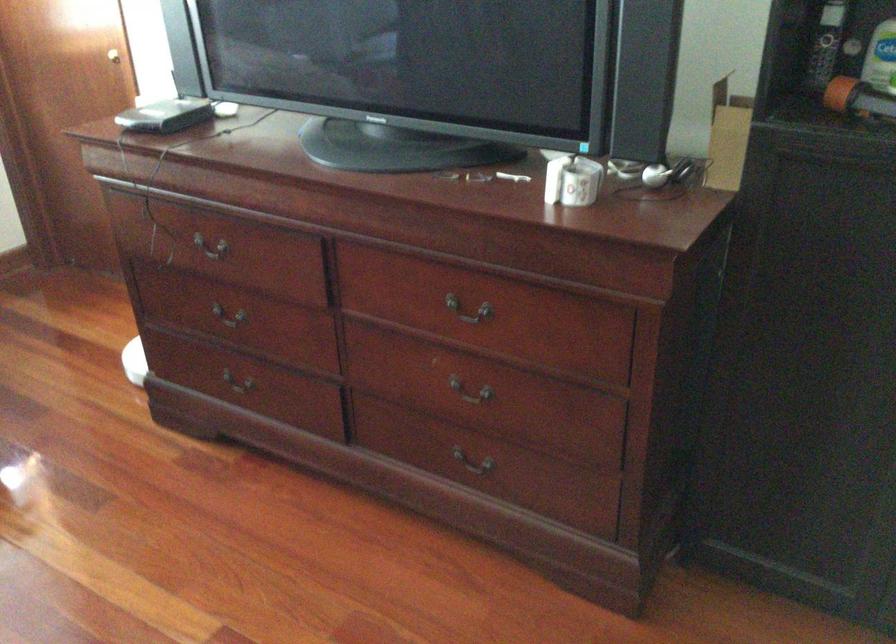
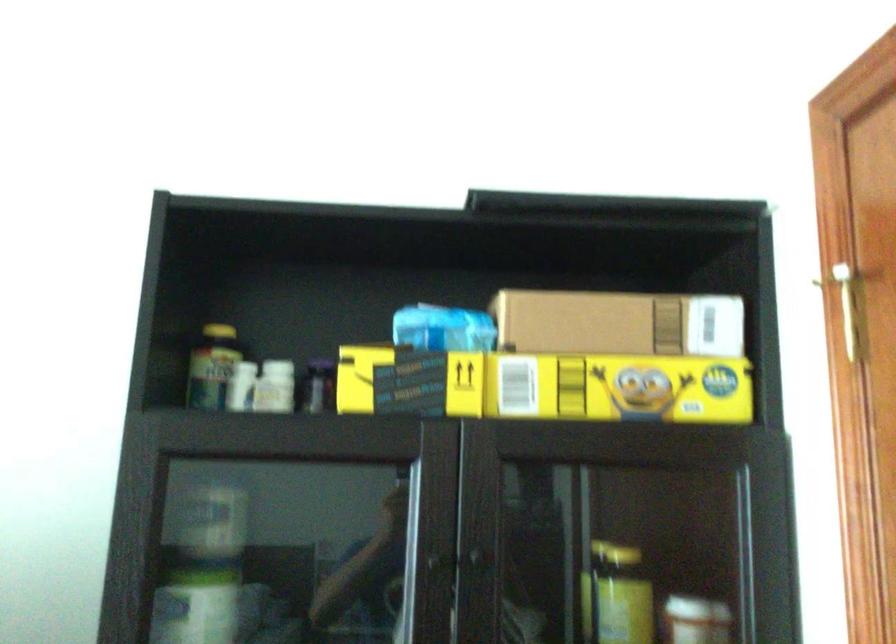
The first image is from the beginning of the video and the second image is from the end. How did the camera likely rotate when shooting the video?

The camera's rotation is toward right-up.